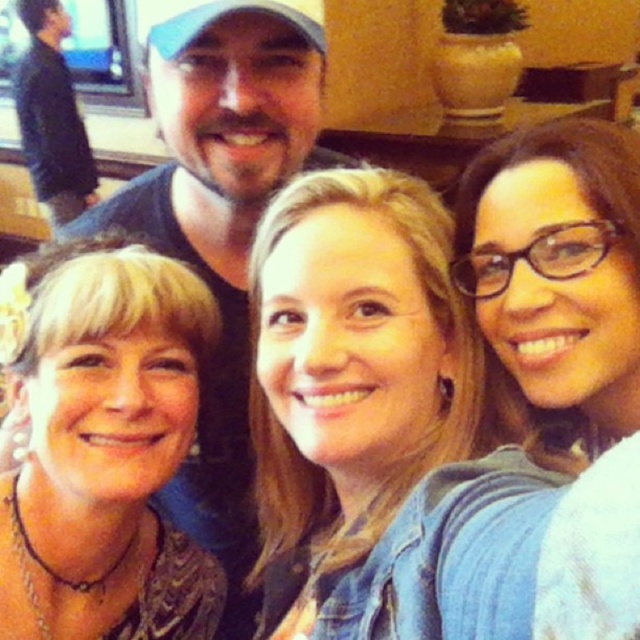
Question: Does matte black shirt at left have a larger size compared to black sweater at upper left?

Choices:
 (A) yes
 (B) no

Answer: (B)

Question: Among these objects, which one is nearest to the camera?

Choices:
 (A) black sweater at upper left
 (B) matte black shirt at left

Answer: (B)

Question: Can you confirm if matte black shirt at left is positioned below black sweater at upper left?

Choices:
 (A) yes
 (B) no

Answer: (A)

Question: Does matte black shirt at left have a smaller size compared to black sweater at upper left?

Choices:
 (A) no
 (B) yes

Answer: (B)

Question: Which object is farther from the camera taking this photo?

Choices:
 (A) matte black shirt at left
 (B) black sweater at upper left

Answer: (B)

Question: Which object is closer to the camera taking this photo?

Choices:
 (A) black sweater at upper left
 (B) matte black shirt at left

Answer: (B)